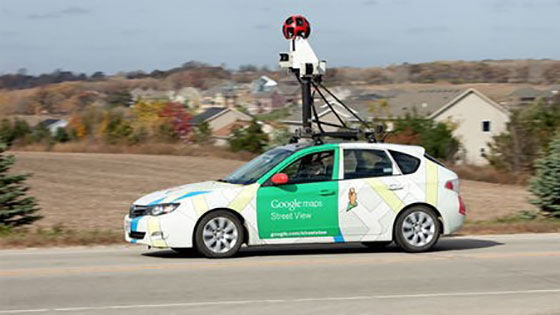
This screenshot has height=315, width=560. What are the coordinates of `homes` in the screenshot? It's located at (452, 117).